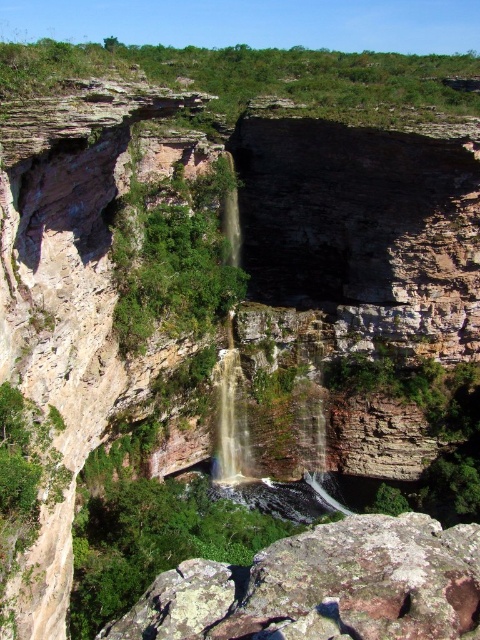
You are a hiker planning to cross the waterfall area. You see a rusty rock at center and a smooth rock waterfall at center. Which rock should you avoid stepping on to prevent slipping?

You should avoid stepping on the smooth rock waterfall at center because smooth rocks near waterfalls are more slippery than rusty rocks at center which have a rougher texture.

You are a hiker standing at the edge of the cliff overlooking the waterfall. You notice two rocks below you. The rusty rock at center and the smooth rock waterfall at center. Which rock is positioned to the right when looking towards the waterfall?

The rusty rock at center is to the right of the smooth rock waterfall at center.